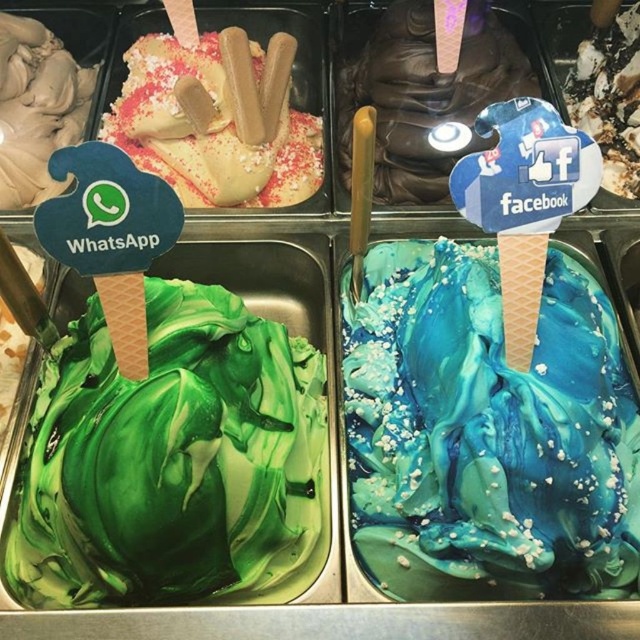
Question: Which point is closer to the camera?

Choices:
 (A) (554, 564)
 (B) (349, 76)

Answer: (A)

Question: Among these objects, which one is nearest to the camera?

Choices:
 (A) blue marbled ice cream at center
 (B) smooth chocolate ice cream at center

Answer: (A)

Question: Is blue marbled ice cream at center to the left of smooth chocolate ice cream cone at upper center from the viewer's perspective?

Choices:
 (A) no
 (B) yes

Answer: (A)

Question: Is blue marbled ice cream at center to the left of smooth chocolate ice cream at center from the viewer's perspective?

Choices:
 (A) no
 (B) yes

Answer: (A)

Question: From the image, what is the correct spatial relationship of green marbled ice cream at left in relation to smooth chocolate ice cream at center?

Choices:
 (A) left
 (B) right

Answer: (A)

Question: Which point is closer to the camera?

Choices:
 (A) (134, 81)
 (B) (108, 426)
 (C) (356, 326)

Answer: (B)